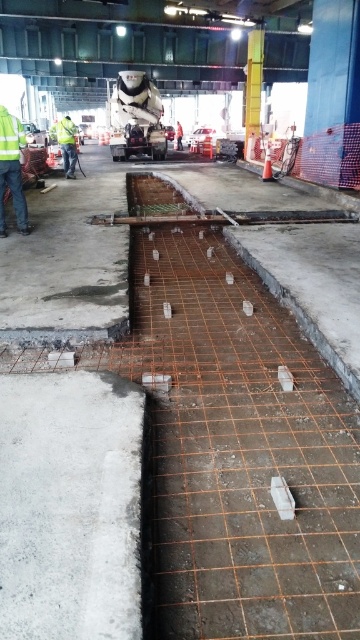
Based on the photo, you are a safety inspector at the construction site. You need to check if the high visibility yellow jacket at left is positioned safely away from the freshly poured white smooth concrete at lower left. According to safety protocols, workers must stay at least 1 meter away from wet concrete. Can you confirm if the jacket is placed safely?

The high visibility yellow jacket at left is positioned to the left of the white smooth concrete at lower left. Since the jacket is to the left of the concrete, it is likely positioned safely away from the wet concrete, meeting the 1 meter distance requirement.

Consider the image. You are a safety inspector at the construction site. You notice the white smooth concrete at lower left and the high visibility yellow jacket at left. Which object takes up more area in the scene?

The high visibility yellow jacket at left takes up more area than the white smooth concrete at lower left.